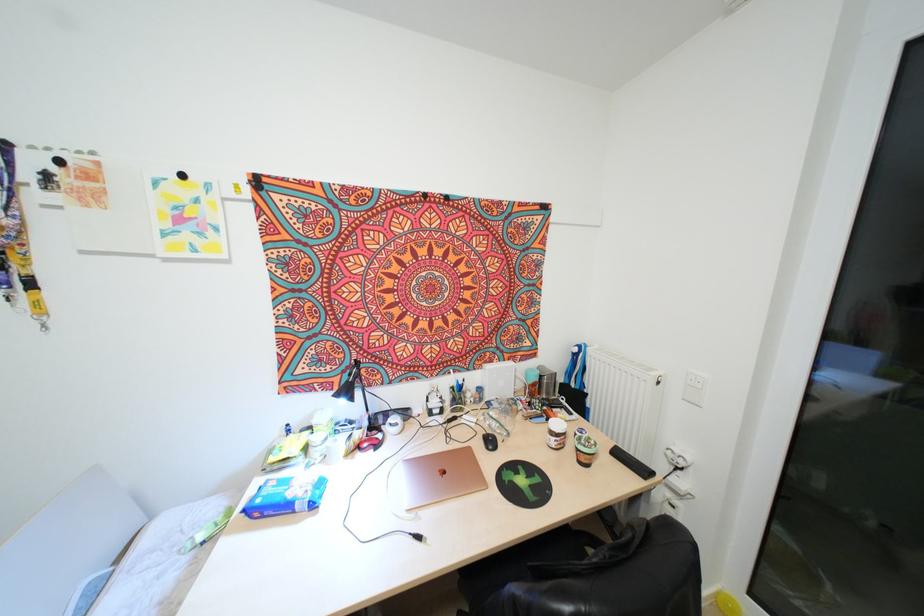
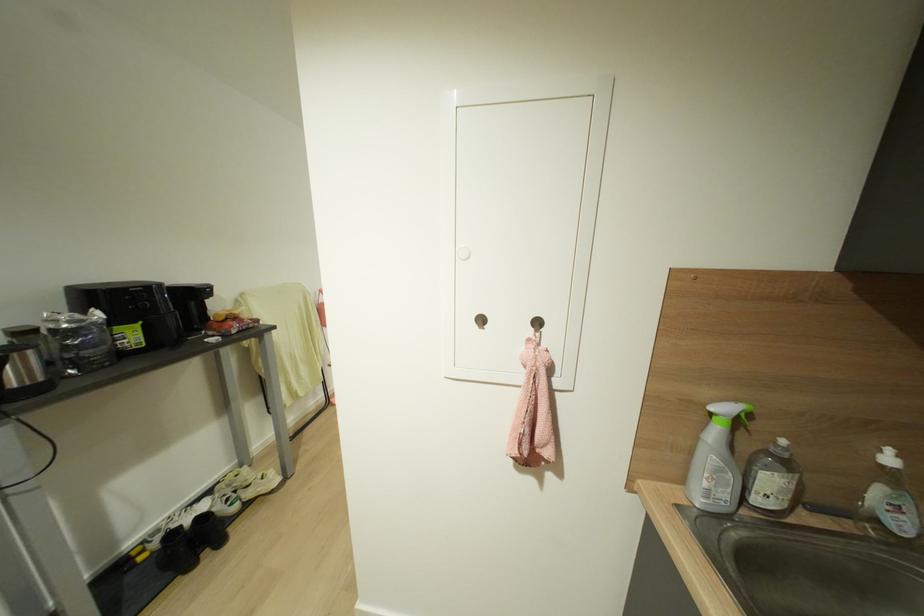
Question: I am providing you with two images of the same scene from different viewpoints. After the viewpoint changes to image2, which objects are now occluded?

Choices:
 (A) chair sitting surface
 (B) yellow box strap
 (C) silver electric kettle
 (D) black shoe

Answer: (A)